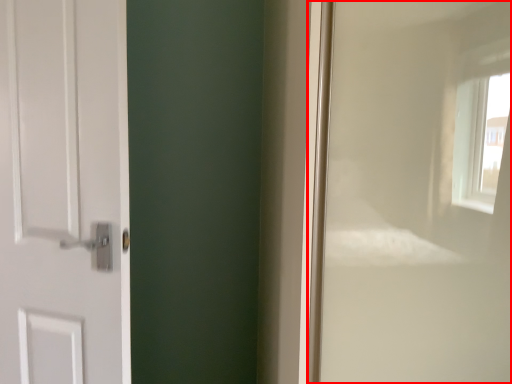
Question: From the image's perspective, where is window frame (annotated by the red box) located relative to door?

Choices:
 (A) below
 (B) above

Answer: (A)